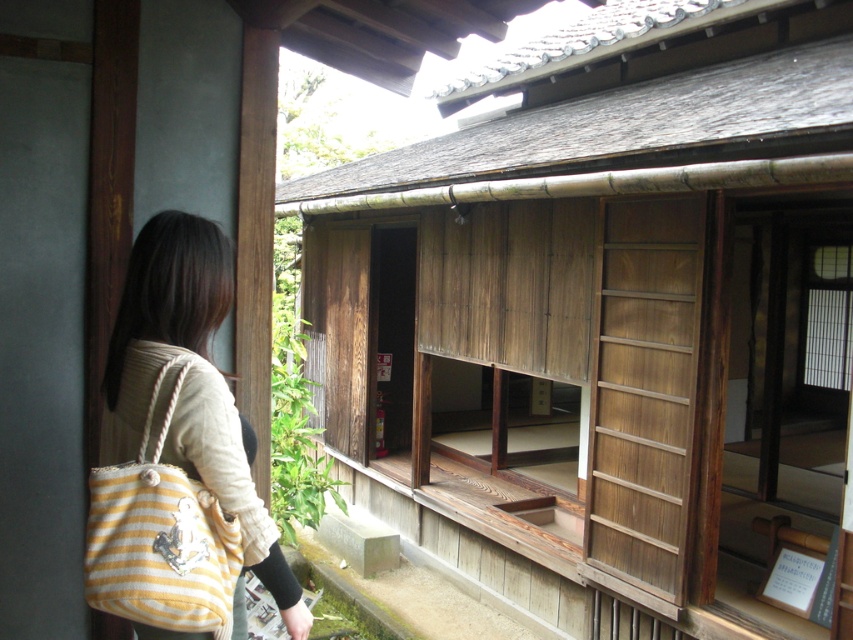
Question: Can you confirm if wooden sliding door at center is thinner than yellow striped fabric shoulder bag at left?

Choices:
 (A) yes
 (B) no

Answer: (A)

Question: Where is wooden sliding door at center located in relation to yellow striped fabric bag at left in the image?

Choices:
 (A) right
 (B) left

Answer: (A)

Question: Which point appears farthest from the camera in this image?

Choices:
 (A) (107, 422)
 (B) (173, 380)
 (C) (312, 352)

Answer: (C)

Question: Which of these objects is positioned closest to the wooden sliding door at center?

Choices:
 (A) yellow striped fabric bag at left
 (B) yellow striped fabric shoulder bag at left

Answer: (A)

Question: Which object is the closest to the yellow striped fabric shoulder bag at left?

Choices:
 (A) wooden sliding door at center
 (B) yellow striped fabric bag at left

Answer: (B)

Question: Is yellow striped fabric bag at left bigger than yellow striped fabric shoulder bag at left?

Choices:
 (A) no
 (B) yes

Answer: (B)